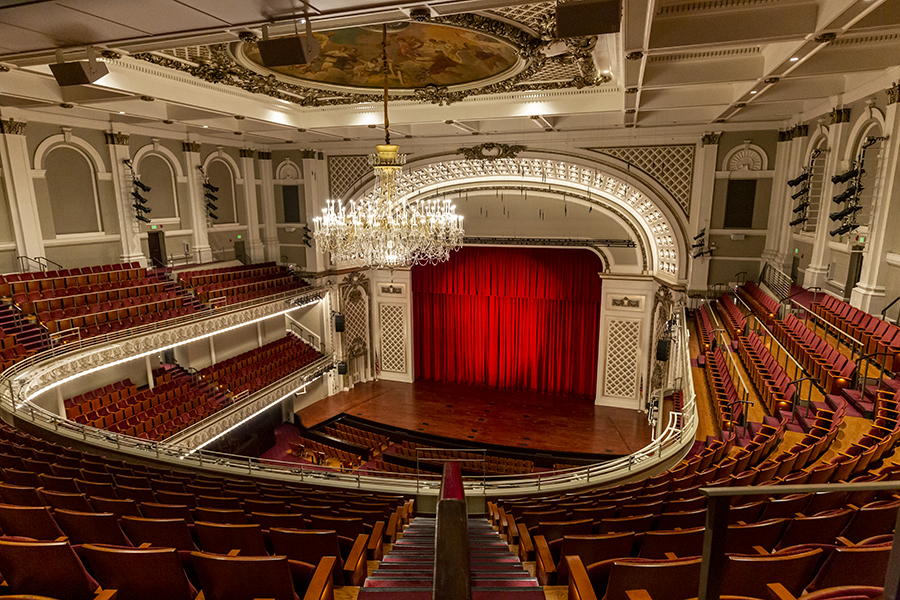
Where is `seats`? The width and height of the screenshot is (900, 600). seats is located at coordinates (605, 548).